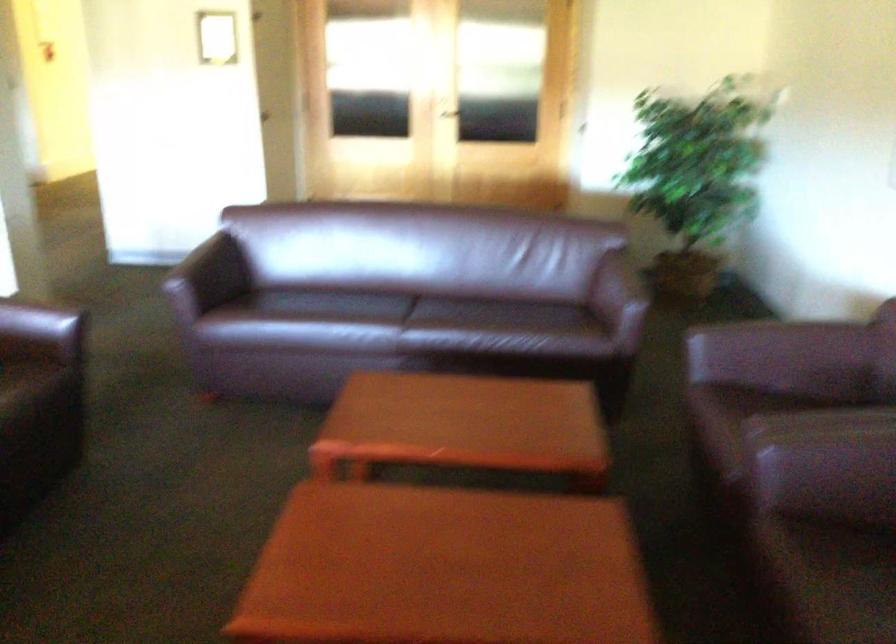
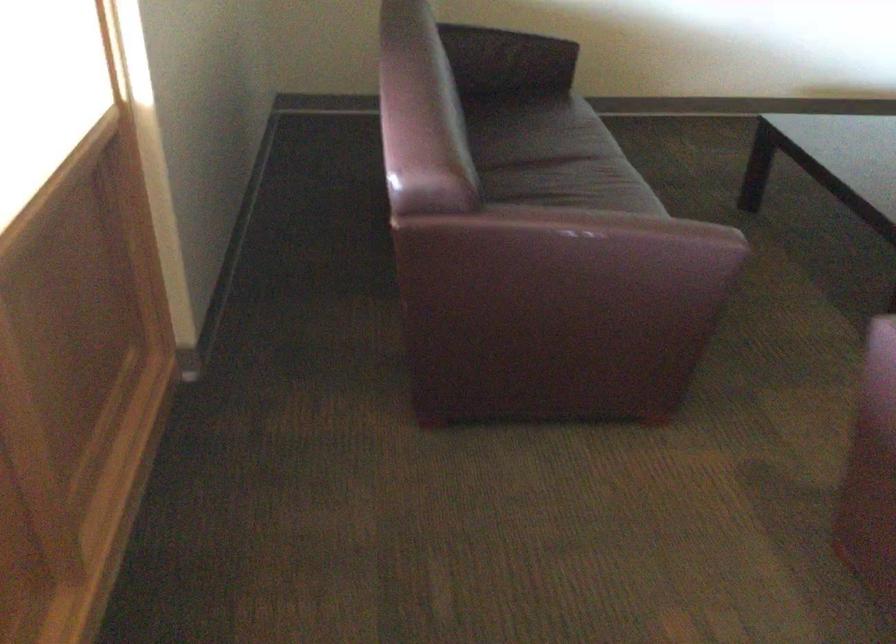
First-person continuous shooting, in which direction is the camera rotating?

The camera rotated toward right-down.